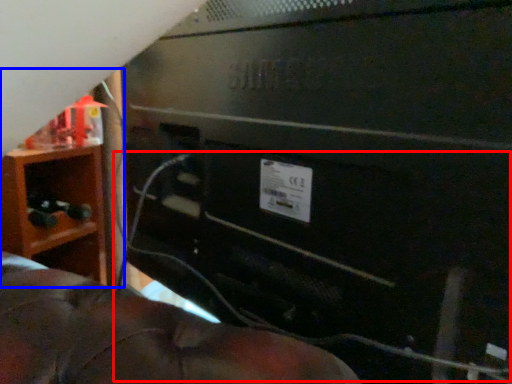
Question: Which point is closer to the camera, wire (highlighted by a red box) or furniture (highlighted by a blue box)?

Choices:
 (A) wire
 (B) furniture

Answer: (A)